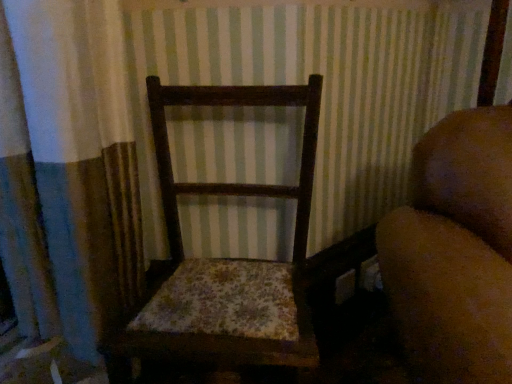
Measure the distance between brown fuzzy couch at right and camera.

37.30 centimeters.

Locate an element on the screen. brown fuzzy couch at right is located at coordinates (455, 251).

The height and width of the screenshot is (384, 512). What do you see at coordinates (455, 251) in the screenshot?
I see `brown fuzzy couch at right` at bounding box center [455, 251].

Describe the element at coordinates (228, 258) in the screenshot. Image resolution: width=512 pixels, height=384 pixels. I see `wooden floral cushioned chair at center` at that location.

At what (x,y) coordinates should I click in order to perform the action: click on wooden floral cushioned chair at center. Please return your answer as a coordinate pair (x, y). Looking at the image, I should click on (228, 258).

Locate an element on the screen. Image resolution: width=512 pixels, height=384 pixels. brown fuzzy couch at right is located at coordinates (455, 251).

Does wooden floral cushioned chair at center appear on the left side of brown fuzzy couch at right?

Yes, wooden floral cushioned chair at center is to the left of brown fuzzy couch at right.

Does wooden floral cushioned chair at center come in front of brown fuzzy couch at right?

No, wooden floral cushioned chair at center is further to the viewer.

Does point (175, 343) appear closer or farther from the camera than point (505, 120)?

Point (175, 343).

From the image's perspective, is wooden floral cushioned chair at center positioned above or below brown fuzzy couch at right?

wooden floral cushioned chair at center is above brown fuzzy couch at right.

From a real-world perspective, is wooden floral cushioned chair at center physically located above or below brown fuzzy couch at right?

wooden floral cushioned chair at center is situated lower than brown fuzzy couch at right in the real world.

Consider the image. In terms of width, does wooden floral cushioned chair at center look wider or thinner when compared to brown fuzzy couch at right?

In the image, wooden floral cushioned chair at center appears to be more narrow than brown fuzzy couch at right.

In terms of height, does wooden floral cushioned chair at center look taller or shorter compared to brown fuzzy couch at right?

Clearly, wooden floral cushioned chair at center is shorter compared to brown fuzzy couch at right.

Between wooden floral cushioned chair at center and brown fuzzy couch at right, which one has smaller size?

wooden floral cushioned chair at center.

Can brown fuzzy couch at right be found inside wooden floral cushioned chair at center?

Actually, brown fuzzy couch at right is outside wooden floral cushioned chair at center.

Is wooden floral cushioned chair at center not near brown fuzzy couch at right?

No, there isn't a large distance between wooden floral cushioned chair at center and brown fuzzy couch at right.

Is wooden floral cushioned chair at center oriented towards brown fuzzy couch at right?

No, wooden floral cushioned chair at center does not turn towards brown fuzzy couch at right.

How many degrees apart are the facing directions of wooden floral cushioned chair at center and brown fuzzy couch at right?

The facing directions of wooden floral cushioned chair at center and brown fuzzy couch at right are 5.04 degrees apart.

This screenshot has height=384, width=512. Identify the location of rocking chair that is under the brown fuzzy couch at right (from a real-world perspective). (228, 258).

Can you confirm if brown fuzzy couch at right is positioned to the right of wooden floral cushioned chair at center?

Result: Yes, brown fuzzy couch at right is to the right of wooden floral cushioned chair at center.

Does brown fuzzy couch at right lie behind wooden floral cushioned chair at center?

No, the depth of brown fuzzy couch at right is less than that of wooden floral cushioned chair at center.

Between point (406, 280) and point (247, 264), which one is positioned in front?

The point (406, 280) is closer to the camera.

From the image's perspective, which is above, brown fuzzy couch at right or wooden floral cushioned chair at center?

wooden floral cushioned chair at center is shown above in the image.

From a real-world perspective, is brown fuzzy couch at right positioned above or below wooden floral cushioned chair at center?

Clearly, from a real-world perspective, brown fuzzy couch at right is above wooden floral cushioned chair at center.

Considering the sizes of objects brown fuzzy couch at right and wooden floral cushioned chair at center in the image provided, who is thinner, brown fuzzy couch at right or wooden floral cushioned chair at center?

wooden floral cushioned chair at center.

Considering the relative sizes of brown fuzzy couch at right and wooden floral cushioned chair at center in the image provided, is brown fuzzy couch at right taller than wooden floral cushioned chair at center?

Correct, brown fuzzy couch at right is much taller as wooden floral cushioned chair at center.

Between brown fuzzy couch at right and wooden floral cushioned chair at center, which one has smaller size?

With smaller size is wooden floral cushioned chair at center.

Is wooden floral cushioned chair at center inside brown fuzzy couch at right?

No, wooden floral cushioned chair at center is not surrounded by brown fuzzy couch at right.

Is brown fuzzy couch at right placed right next to wooden floral cushioned chair at center?

No, brown fuzzy couch at right is not beside wooden floral cushioned chair at center.

Is brown fuzzy couch at right oriented away from wooden floral cushioned chair at center?

No, brown fuzzy couch at right is not facing the opposite direction of wooden floral cushioned chair at center.

How many degrees apart are the facing directions of brown fuzzy couch at right and wooden floral cushioned chair at center?

5.04 degrees.

Find the location of `furniture below the wooden floral cushioned chair at center (from the image's perspective)`. furniture below the wooden floral cushioned chair at center (from the image's perspective) is located at coordinates (455, 251).

Image resolution: width=512 pixels, height=384 pixels. I want to click on rocking chair below the brown fuzzy couch at right (from a real-world perspective), so click(x=228, y=258).

Locate an element on the screen. The height and width of the screenshot is (384, 512). rocking chair located on the left of brown fuzzy couch at right is located at coordinates (228, 258).